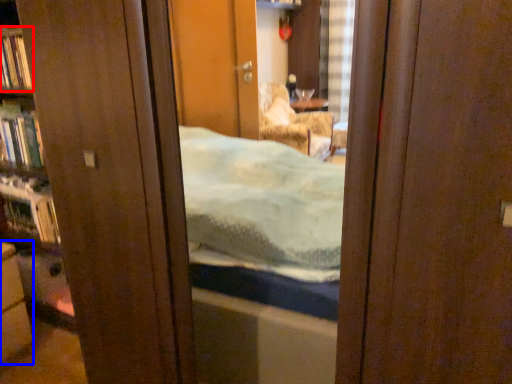
Question: Which object is closer to the camera taking this photo, book (highlighted by a red box) or cabinetry (highlighted by a blue box)?

Choices:
 (A) book
 (B) cabinetry

Answer: (B)